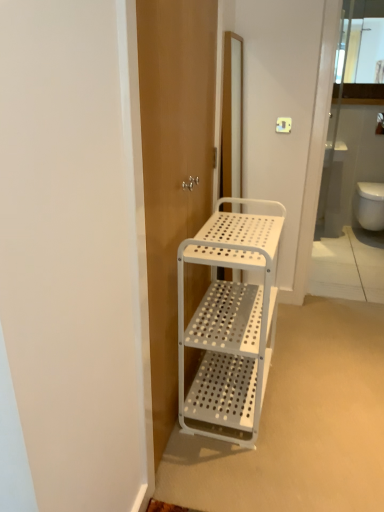
Question: From their relative heights in the image, would you say white perforated cabinet at upper center is taller or shorter than white perforated metal cart at center?

Choices:
 (A) short
 (B) tall

Answer: (A)

Question: From the image's perspective, is white perforated cabinet at upper center positioned above or below white perforated metal cart at center?

Choices:
 (A) below
 (B) above

Answer: (B)

Question: Based on their relative distances, which object is farther from the white perforated cabinet at upper center?

Choices:
 (A) white glossy toilet bowl at lower right
 (B) white perforated metal cart at center
 (C) white perforated screen door at center

Answer: (B)

Question: Estimate the real-world distances between objects in this image. Which object is closer to the white perforated cabinet at upper center?

Choices:
 (A) white perforated metal cart at center
 (B) white perforated screen door at center
 (C) white glossy toilet bowl at lower right

Answer: (C)